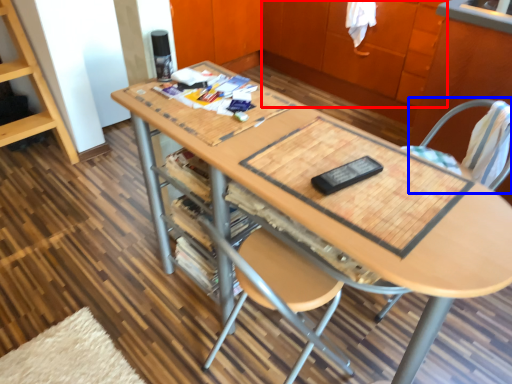
Question: Among these objects, which one is farthest to the camera, cabinetry (highlighted by a red box) or swivel chair (highlighted by a blue box)?

Choices:
 (A) cabinetry
 (B) swivel chair

Answer: (A)